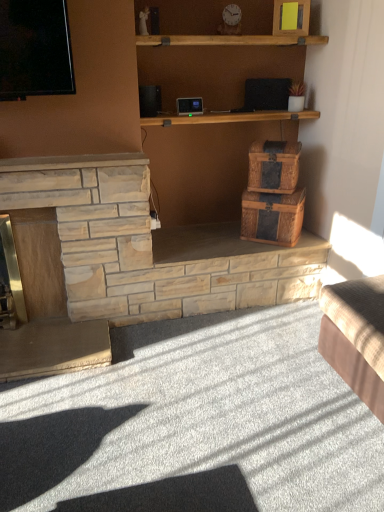
Question: From the image's perspective, is woven brown crate at center-right above or below natural stone fireplace at left?

Choices:
 (A) below
 (B) above

Answer: (B)

Question: Relative to natural stone fireplace at left, is woven brown crate at center-right in front or behind?

Choices:
 (A) front
 (B) behind

Answer: (B)

Question: Estimate the real-world distances between objects in this image. Which object is closer to the beige fabric couch at lower right?

Choices:
 (A) woven brown crate at center-right
 (B) woven wood chest at center
 (C) natural stone fireplace at left

Answer: (B)

Question: Estimate the real-world distances between objects in this image. Which object is closer to the woven brown crate at center-right?

Choices:
 (A) natural stone fireplace at left
 (B) beige fabric couch at lower right
 (C) woven wood chest at center

Answer: (C)